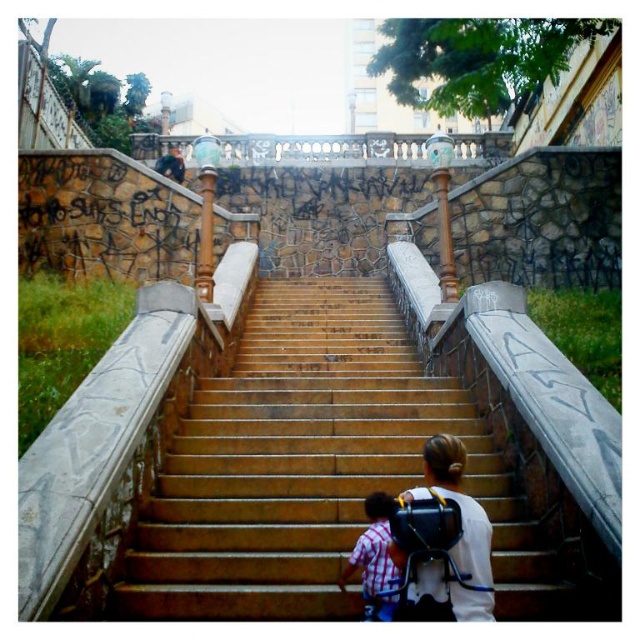
You are standing at the bottom of the brown polished stone stairs at center and want to place your white matte backpack at center on the stairs. Can you do that?

The brown polished stone stairs at center is positioned on the left side of white matte backpack at center, so the backpack is not on the stairs. Therefore, you can place your white matte backpack at center on the stairs.

You are standing at the entrance of the staircase and want to reach the top. Given the coordinates of the brown polished stone stairs at center, can you determine if they are positioned to your left or right side?

The brown polished stone stairs at center are located at coordinates point (316, 468), which places them directly in front of you, not to your left or right side.

You are carrying a white matte backpack at center and wearing a plaid shirt at lower center. Do you think the backpack might be wider than your shirt?

The white matte backpack at center might be wider than plaid shirt at lower center according to the description.